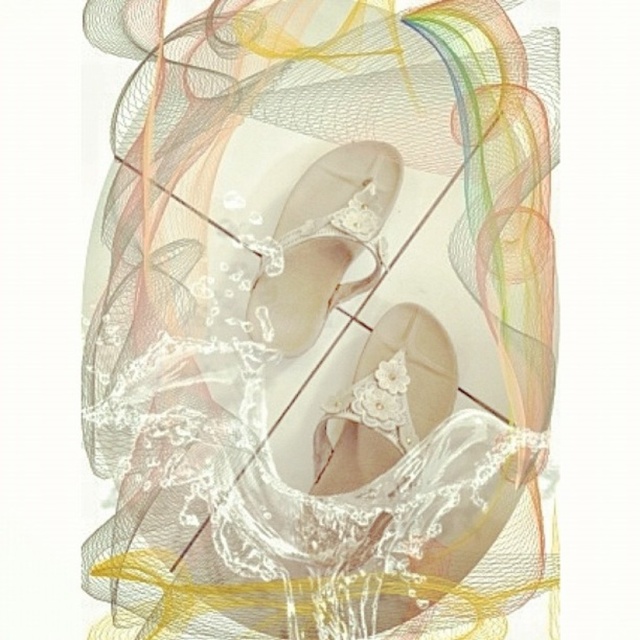
You are a professional shoemaker who needs to place both the pearl white satin sandal at center and the pearl white lace sandal at center into a rectangular display box. The box has a width of 5 inches. Can both sandals fit side by side in the box without overlapping?

The distance between the pearl white satin sandal at center and pearl white lace sandal at center is 4.50 inches. Since the box is 5 inches wide, there is enough space to fit both sandals side by side without overlapping.